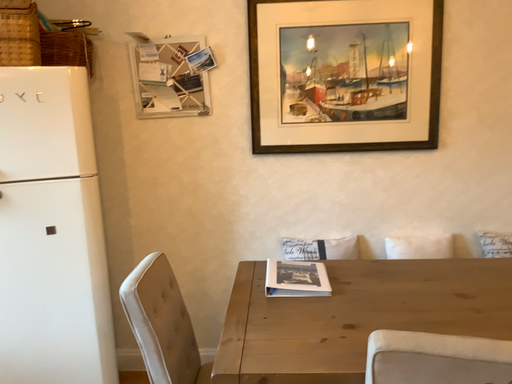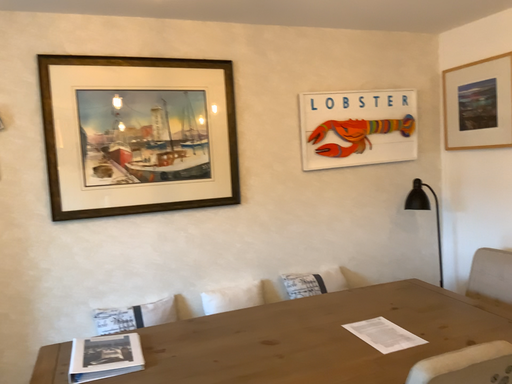
Question: Which way did the camera rotate in the video?

Choices:
 (A) rotated left
 (B) rotated right

Answer: (B)